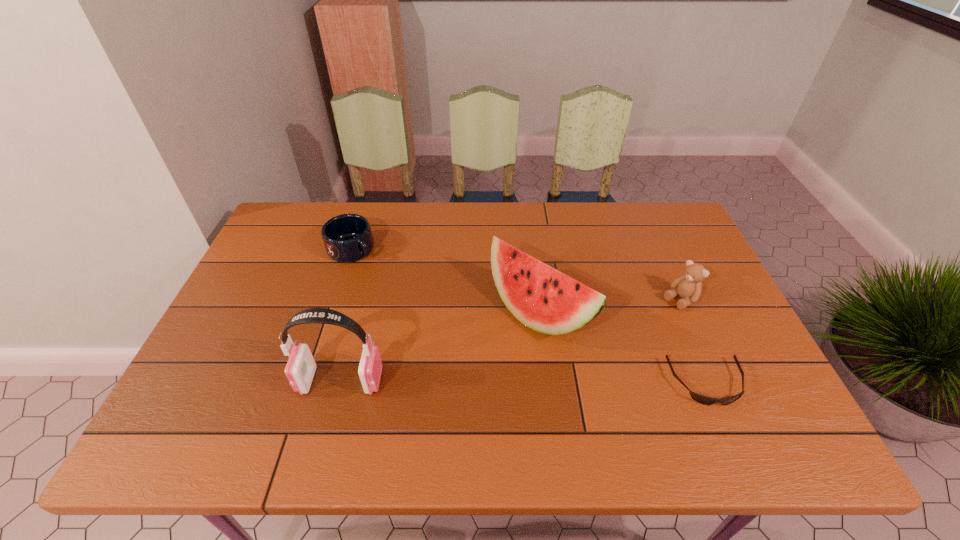
Identify the location of earphone located in the near edge section of the desktop. (300, 369).

Where is `sunglasses located at the near edge`? sunglasses located at the near edge is located at coordinates (701, 399).

Locate an element on the screen. sunglasses present at the right edge is located at coordinates (701, 399).

Where is `teddy bear that is at the right edge`? teddy bear that is at the right edge is located at coordinates (688, 286).

Find the location of a particular element. The image size is (960, 540). object situated at the near right corner is located at coordinates (701, 399).

Locate an element on the screen. This screenshot has height=540, width=960. vacant space at the far edge of the desktop is located at coordinates (588, 239).

Where is `vacant space at the near edge of the desktop`? The width and height of the screenshot is (960, 540). vacant space at the near edge of the desktop is located at coordinates (598, 385).

This screenshot has width=960, height=540. In order to click on blank space at the left edge of the desktop in this screenshot , I will do `click(251, 355)`.

In the image, there is a desktop. Identify the location of vacant region at the right edge. This screenshot has width=960, height=540. (747, 354).

Locate an element on the screen. blank region between the sunglasses and the earphone is located at coordinates (523, 382).